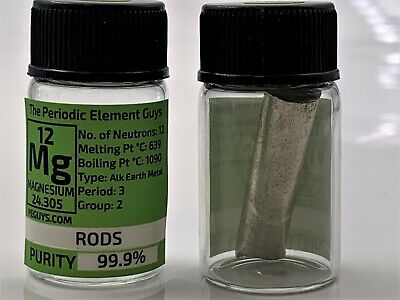
You are a GUI agent. You are given a task and a screenshot of the screen. Output one action in this format:
    pyautogui.click(x=<x>, y=<y>)
    Task: Click on the glass
    The height and width of the screenshot is (300, 400).
    Given the screenshot: What is the action you would take?
    pyautogui.click(x=94, y=97), pyautogui.click(x=235, y=192)